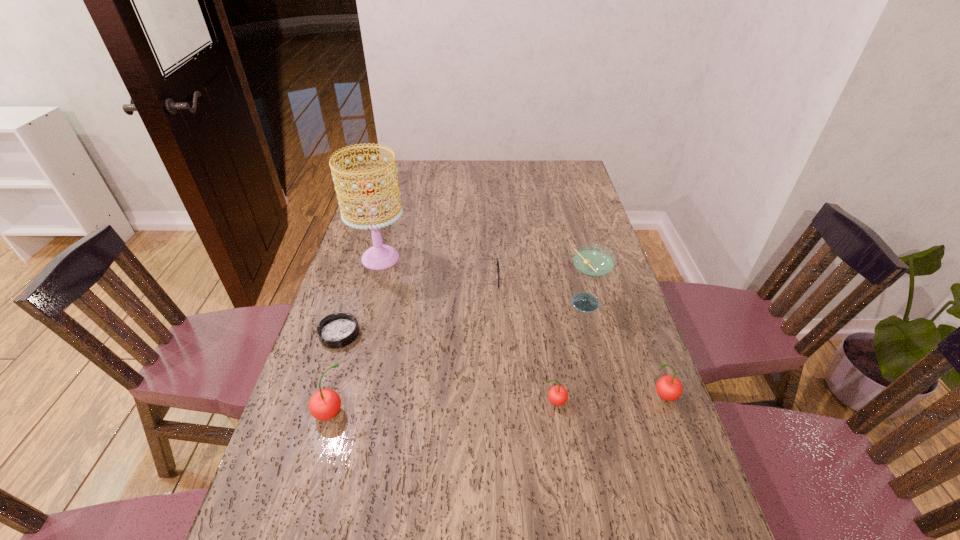
To ensure equal spacing by inserting another cherry among them, please point out a vacant spot for this new cherry. Please provide its 2D coordinates. Your answer should be formatted as a tuple, i.e. [(x, y)], where the tuple contains the x and y coordinates of a point satisfying the conditions above.

[(444, 408)]